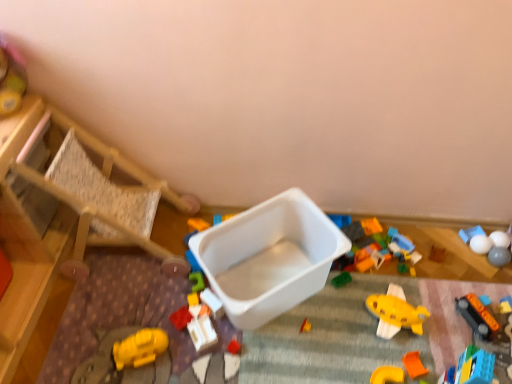
This screenshot has height=384, width=512. I want to click on vacant space that's between orange plastic train at lower right, which is the 5th toy in right-to-left order, and yellow matte airplane at center, placed as the eighth toy when sorted from right to left, so click(440, 325).